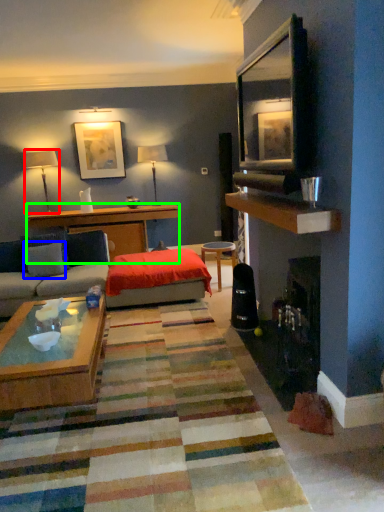
Question: Which is nearer to the lamp (highlighted by a red box)? pillow (highlighted by a blue box) or desk (highlighted by a green box).

Choices:
 (A) pillow
 (B) desk

Answer: (B)